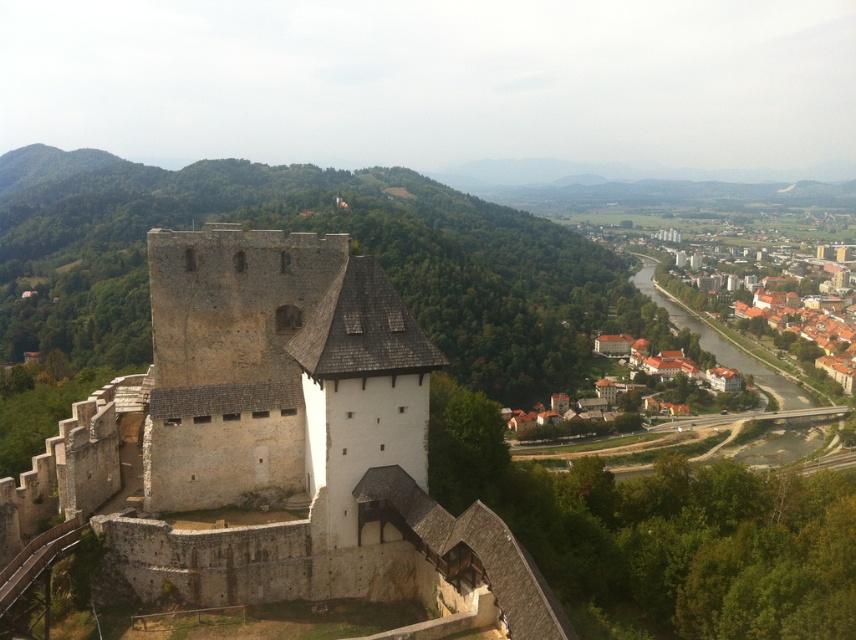
The height and width of the screenshot is (640, 856). Find the location of `white stone castle at center`. white stone castle at center is located at coordinates click(275, 444).

Is point (389, 536) more distant than point (829, 323)?

No, (389, 536) is in front of (829, 323).

Is point (269, 285) farther from viewer compared to point (839, 324)?

No, it is in front of (839, 324).

The width and height of the screenshot is (856, 640). I want to click on white stone castle at center, so pyautogui.click(x=275, y=444).